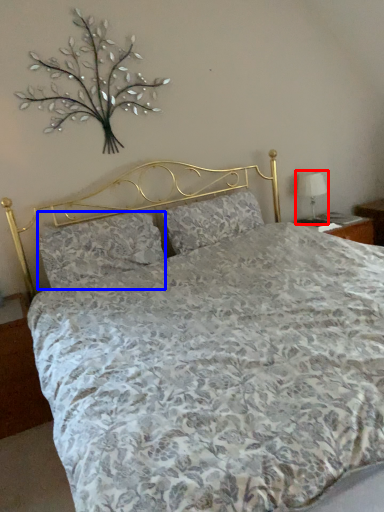
Question: Which of the following is the farthest to the observer, table lamp (highlighted by a red box) or pillow (highlighted by a blue box)?

Choices:
 (A) table lamp
 (B) pillow

Answer: (A)